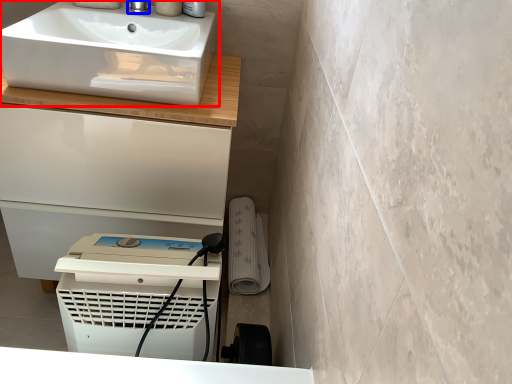
Question: Which object appears closest to the camera in this image, sink (highlighted by a red box) or tap (highlighted by a blue box)?

Choices:
 (A) sink
 (B) tap

Answer: (A)